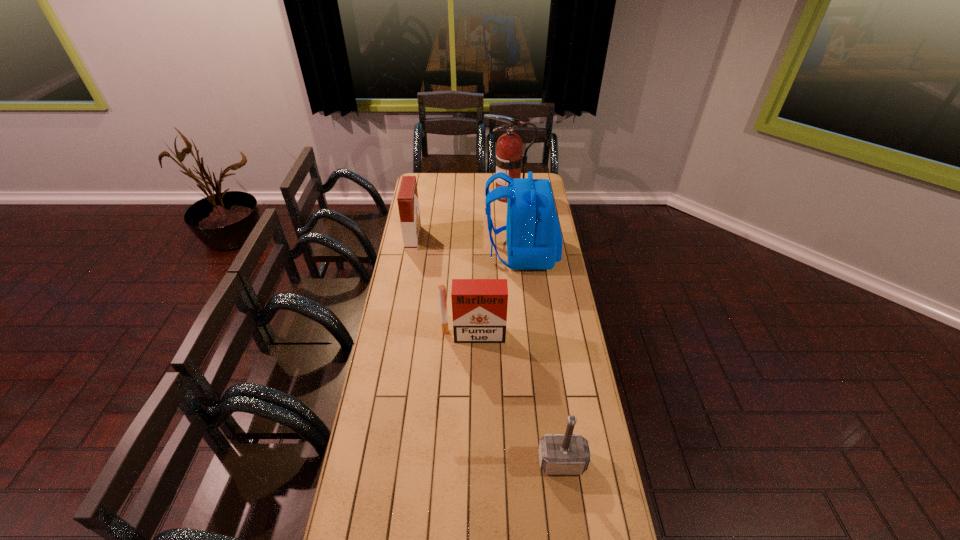
Find the location of `vacant space situated on the back of the backpack`. vacant space situated on the back of the backpack is located at coordinates (468, 253).

Locate an element on the screen. This screenshot has height=540, width=960. vacant space located 0.280m on the back of the backpack is located at coordinates (431, 253).

What are the coordinates of `free space located on the back of the backpack` in the screenshot? It's located at (423, 253).

I want to click on vacant region located on the front-facing side of the leftmost object, so click(428, 238).

Identify the location of free spot located 0.190m on the front-facing side of the fourth farthest object. (472, 381).

Identify the location of vacant space located for striking with the head of the nearest object. (567, 498).

This screenshot has width=960, height=540. Identify the location of object that is positioned at the far edge. (508, 159).

In order to click on object at the left edge in this screenshot , I will do `click(408, 204)`.

Locate an element on the screen. The width and height of the screenshot is (960, 540). fire extinguisher that is positioned at the right edge is located at coordinates (508, 159).

Find the location of a particular element. The image size is (960, 540). backpack that is at the right edge is located at coordinates (534, 241).